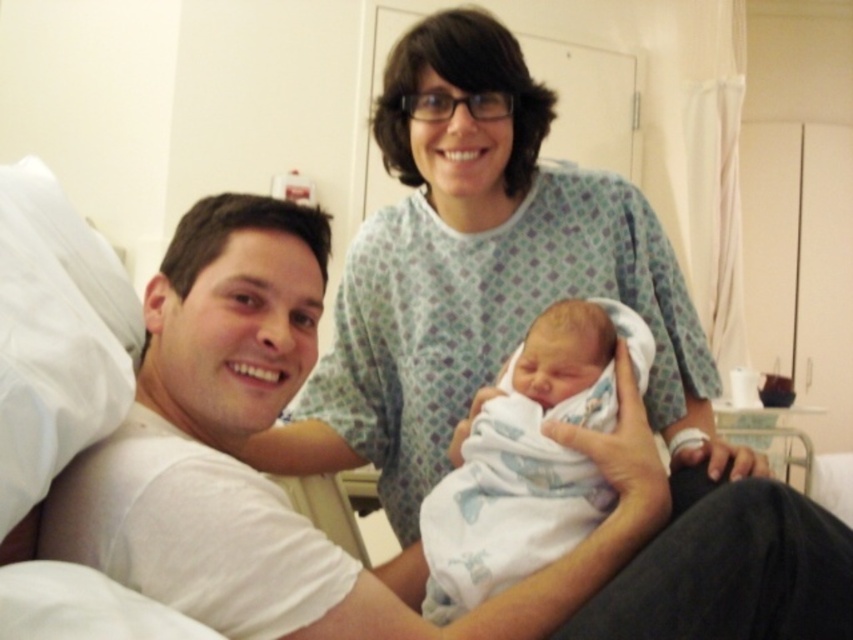
How much distance is there between white cotton shirt at center and white swaddled newborn at center?

The distance of white cotton shirt at center from white swaddled newborn at center is 4.91 inches.

Can you confirm if white cotton shirt at center is smaller than white swaddled newborn at center?

Incorrect, white cotton shirt at center is not smaller in size than white swaddled newborn at center.

Which is behind, point (274, 337) or point (576, 464)?

Positioned behind is point (576, 464).

At what (x,y) coordinates should I click in order to perform the action: click on white cotton shirt at center. Please return your answer as a coordinate pair (x, y). Image resolution: width=853 pixels, height=640 pixels. Looking at the image, I should click on (415, 545).

Describe the element at coordinates (415, 545) in the screenshot. I see `white cotton shirt at center` at that location.

Which is above, white cotton shirt at center or white printed scrubs at upper center?

white printed scrubs at upper center is above.

Which is in front, point (357, 621) or point (467, 394)?

Positioned in front is point (357, 621).

Where is `white cotton shirt at center`? The image size is (853, 640). white cotton shirt at center is located at coordinates (415, 545).

Identify the location of white printed scrubs at upper center. The height and width of the screenshot is (640, 853). (480, 276).

Who is higher up, white printed scrubs at upper center or white swaddled newborn at center?

white printed scrubs at upper center is above.

Image resolution: width=853 pixels, height=640 pixels. Describe the element at coordinates (480, 276) in the screenshot. I see `white printed scrubs at upper center` at that location.

Find the location of a particular element. This screenshot has width=853, height=640. white printed scrubs at upper center is located at coordinates click(x=480, y=276).